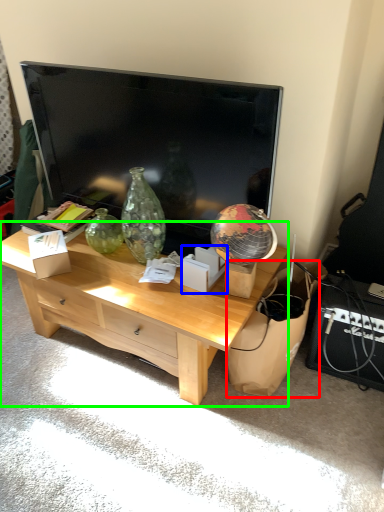
Question: Based on their relative distances, which object is nearer to cardboard (highlighted by a red box)? Choose from cardboard box (highlighted by a blue box) and desk (highlighted by a green box).

Choices:
 (A) cardboard box
 (B) desk

Answer: (A)